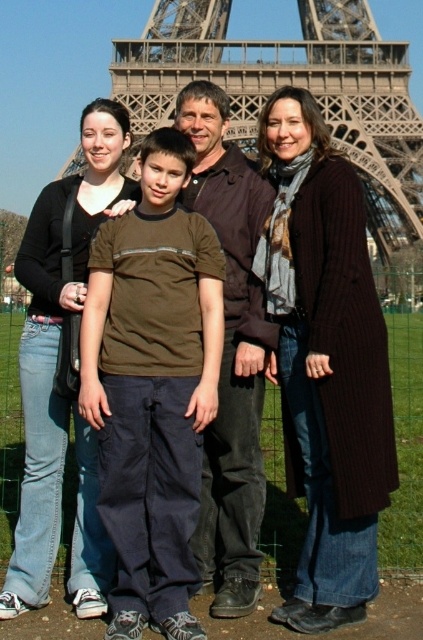
You are standing in front of the Eiffel Tower and see two points marked in the image. The first point is at coordinate point (173, 435) and the second point is at coordinate point (275, 618). Which point is closer to you?

Point (173, 435) is closer to you since it is further to the camera than point (275, 618).

You are a photographer standing 5 meters away from the family. You want to take a photo that includes both the brown cotton shirt at center and the jeans at left. What is the minimum distance you need to move backward to ensure both are fully in frame?

The brown cotton shirt at center is 7.24 meters from the jeans at left. To include both in the frame, you need to move back to a distance where your camera can capture objects 7.24 meters apart. Since you are currently 5 meters away, moving back to at least 7.24 meters would ensure both are in frame.

You are a photographer trying to capture a group photo of the family. You notice the brown cotton shirt at center and the jeans at left. Which clothing item appears wider in the photo?

The brown cotton shirt at center appears wider than the jeans at left because its width surpasses that of the jeans at left.